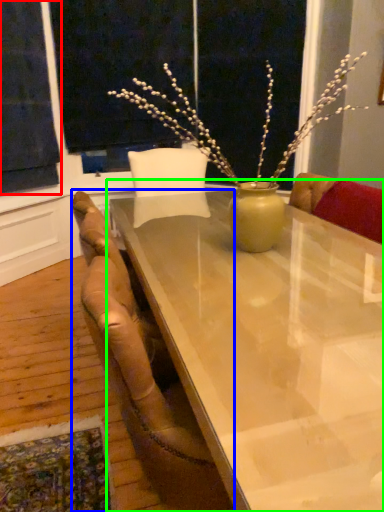
Question: Which object is positioned closest to curtain (highlighted by a red box)? Select from chair (highlighted by a blue box) and table (highlighted by a green box).

Choices:
 (A) chair
 (B) table

Answer: (A)